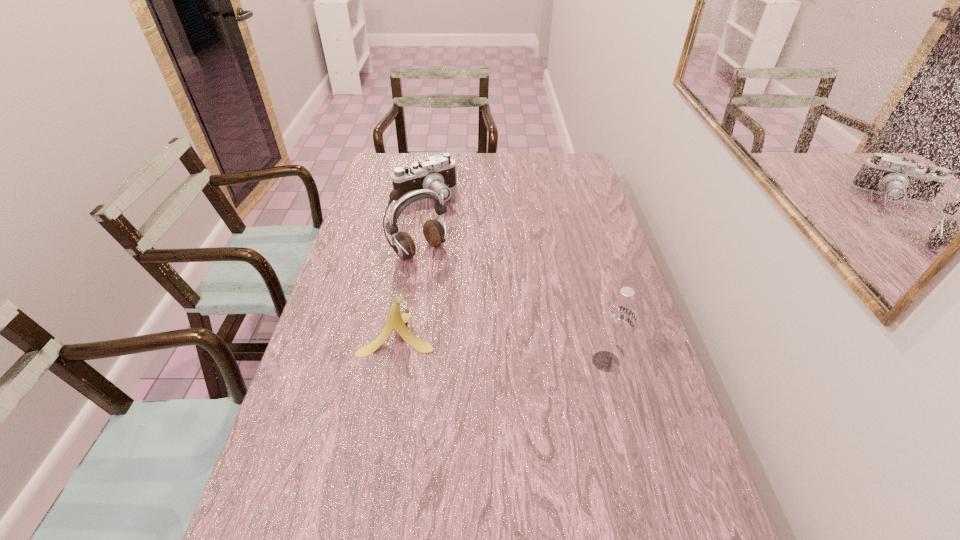
At what (x,y) coordinates should I click in order to perform the action: click on free space located on the ear pads of the third nearest object. Please return your answer as a coordinate pair (x, y). This screenshot has height=540, width=960. Looking at the image, I should click on (444, 272).

Find the location of a particular element. Image resolution: width=960 pixels, height=540 pixels. free space located 0.390m on the ear pads of the third nearest object is located at coordinates (513, 340).

At what (x,y) coordinates should I click in order to perform the action: click on banana that is at the left edge. Please return your answer as a coordinate pair (x, y). Looking at the image, I should click on (395, 320).

In order to click on camera located in the left edge section of the desktop in this screenshot , I will do `click(437, 173)`.

You are a GUI agent. You are given a task and a screenshot of the screen. Output one action in this format:
    pyautogui.click(x=<x>, y=<y>)
    Task: Click on the earphone located at the left edge
    
    Given the screenshot: What is the action you would take?
    pyautogui.click(x=434, y=233)

In order to click on object at the right edge in this screenshot , I will do (618, 321).

Where is `vacant space at the far edge of the desktop`? This screenshot has height=540, width=960. vacant space at the far edge of the desktop is located at coordinates (532, 168).

Locate an element on the screen. This screenshot has height=540, width=960. free point at the near edge is located at coordinates (585, 512).

Identify the location of free spot at the left edge of the desktop. The height and width of the screenshot is (540, 960). (344, 401).

Where is `vacant point at the right edge`? This screenshot has height=540, width=960. vacant point at the right edge is located at coordinates (565, 189).